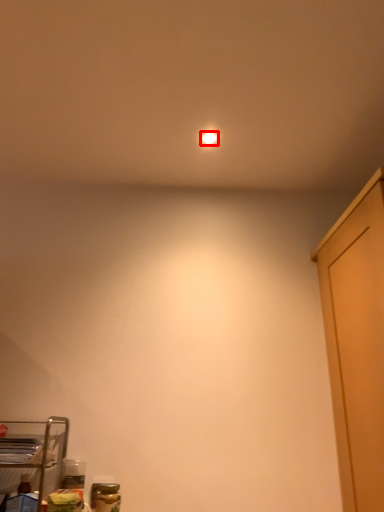
Question: Where is lighting (annotated by the red box) located in relation to furniture in the image?

Choices:
 (A) right
 (B) left

Answer: (A)